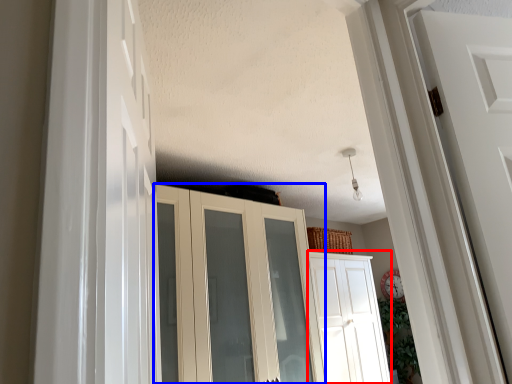
Question: Which object appears farthest to the camera in this image, door (highlighted by a red box) or cupboard (highlighted by a blue box)?

Choices:
 (A) door
 (B) cupboard

Answer: (A)